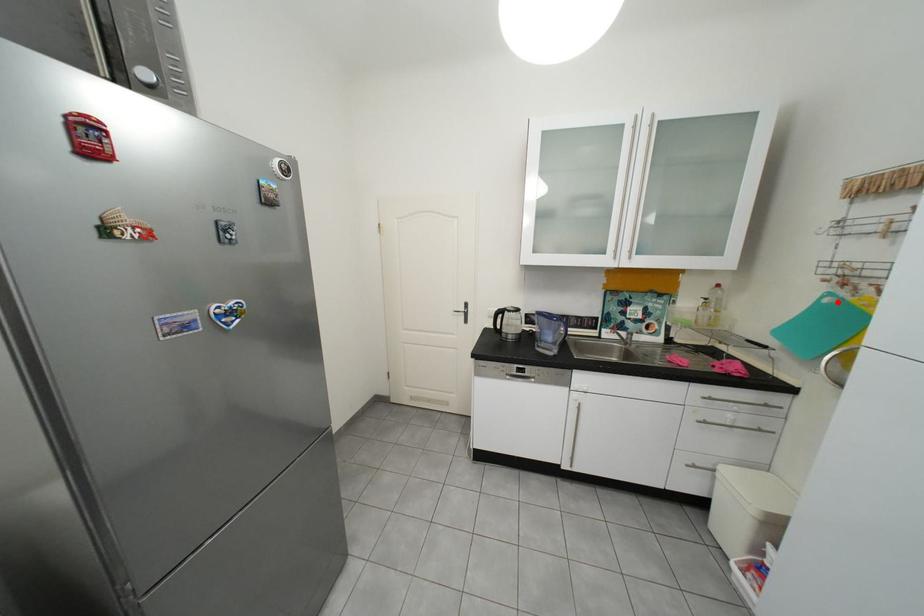
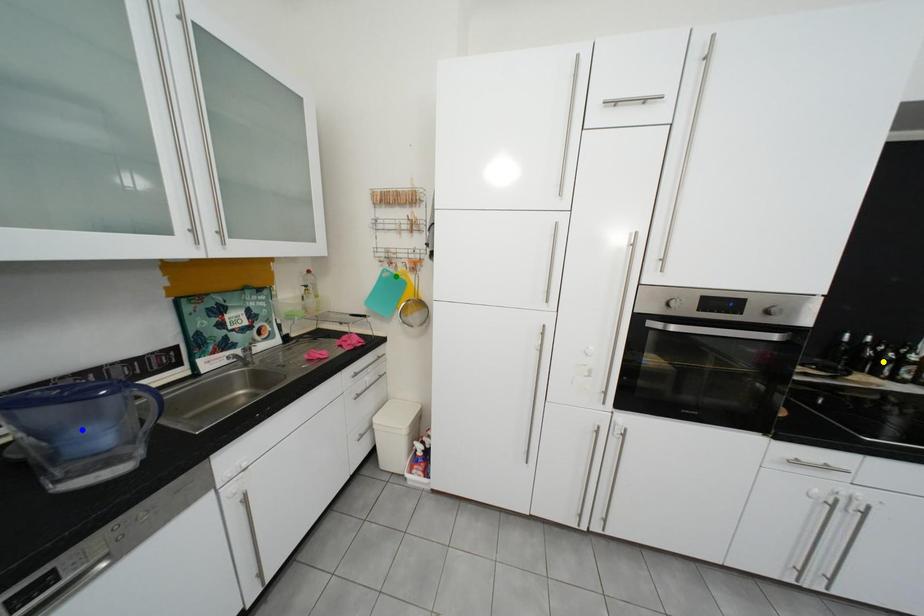
Question: I am providing you with two images of the same scene from different viewpoints. A red point is marked on the first image. You are given multiple points on the second image. Which point in image 2 represents the same 3d spot as the red point in image 1?

Choices:
 (A) yellow point
 (B) green point
 (C) blue point

Answer: (B)